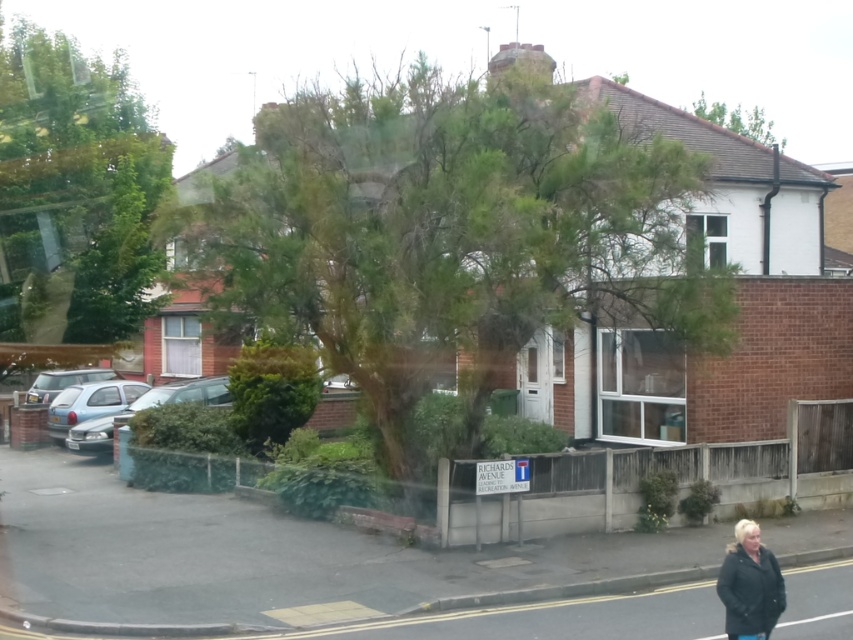
You are a delivery driver trying to park your truck between the light blue metallic hatchback at left and the silver metallic car at left. The truck is 2.5 meters wide. Can you fit your truck between them?

The light blue metallic hatchback at left might be wider than silver metallic car at left, so it is uncertain if there is enough space for the truck. Check the actual distance before attempting to park.

You are looking through the window at the residential street scene. There are two points marked in the image, one at coordinates point (570, 282) and the other at point (126, 394). Which of these two points is nearer to your viewpoint?

Point (570, 282) is closer to the camera than point (126, 394), so the point at coordinates point (570, 282) is nearer to your viewpoint.

You are an architect designing a new house and want to ensure that the front yard has a tree positioned exactly at the center of the image. Based on the scene provided, where is the green leafy tree at center located?

The green leafy tree at center is located at point (447, 236), which is slightly to the left of the true center of the image.